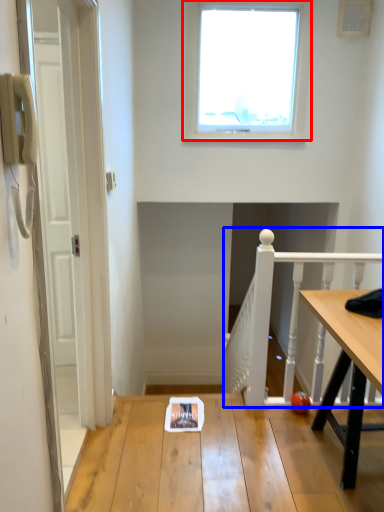
Question: Which point is further to the camera, window (highlighted by a red box) or rail (highlighted by a blue box)?

Choices:
 (A) window
 (B) rail

Answer: (A)